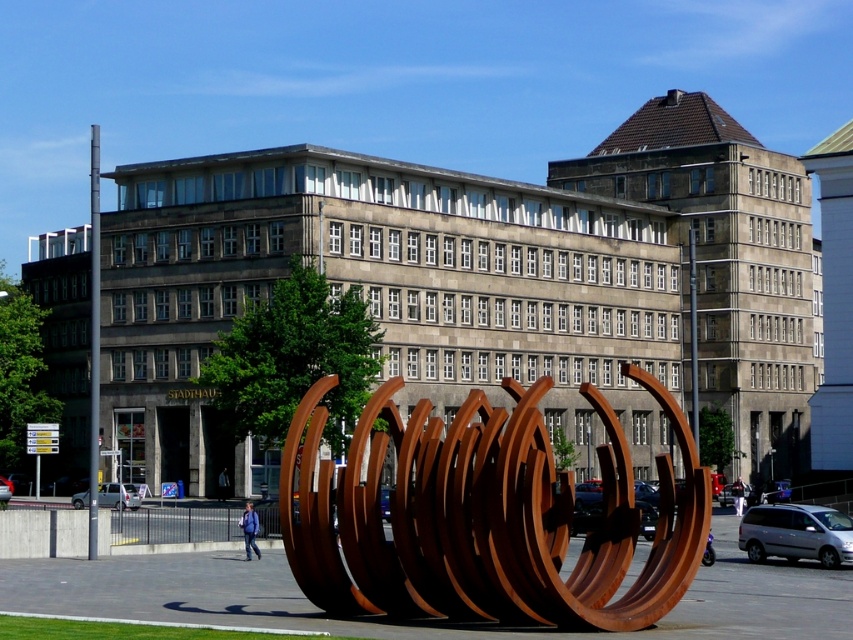
You are a visitor at the building and you see the rusty metal sculpture at center and the light beige fabric jacket at lower right. Which object is taller?

The rusty metal sculpture at center is taller than the light beige fabric jacket at lower right.

You are a photographer planning to capture the rusty metal sculpture at center and the light beige fabric jacket at lower right in a single frame. Based on their sizes, which object should you position closer to the camera to ensure both fit within the frame?

The rusty metal sculpture at center is wider than the light beige fabric jacket at lower right. To fit both in the frame, position the rusty metal sculpture at center closer to the camera since its larger size requires more space, allowing the smaller jacket to occupy less area in the background.